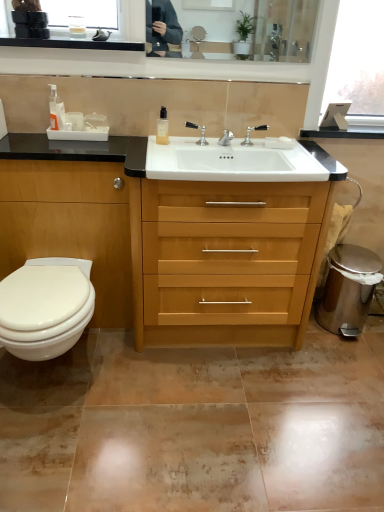
At what (x,y) coordinates should I click in order to perform the action: click on vacant space to the left of polished chrome faucet at center. Please return your answer as a coordinate pair (x, y). This screenshot has height=512, width=384. Looking at the image, I should click on click(220, 145).